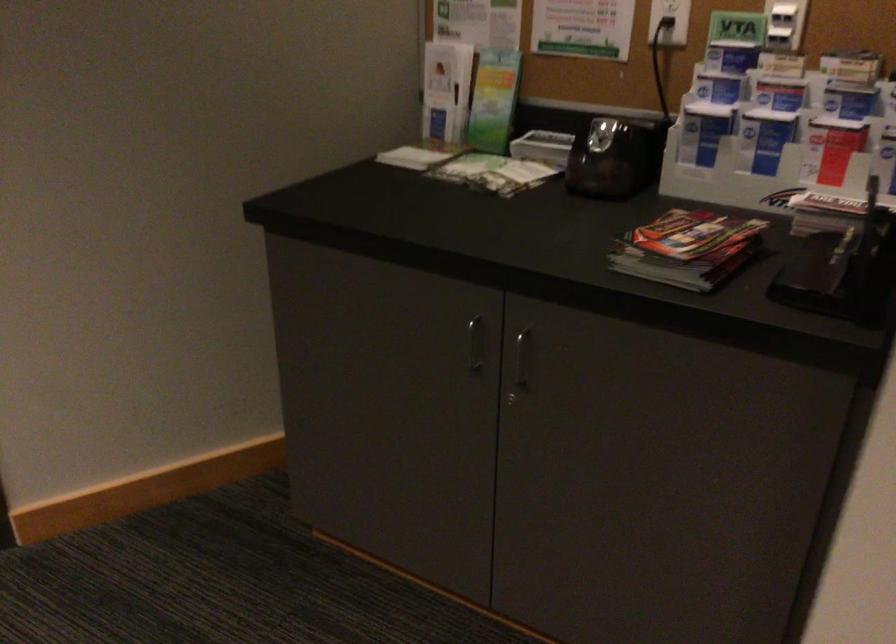
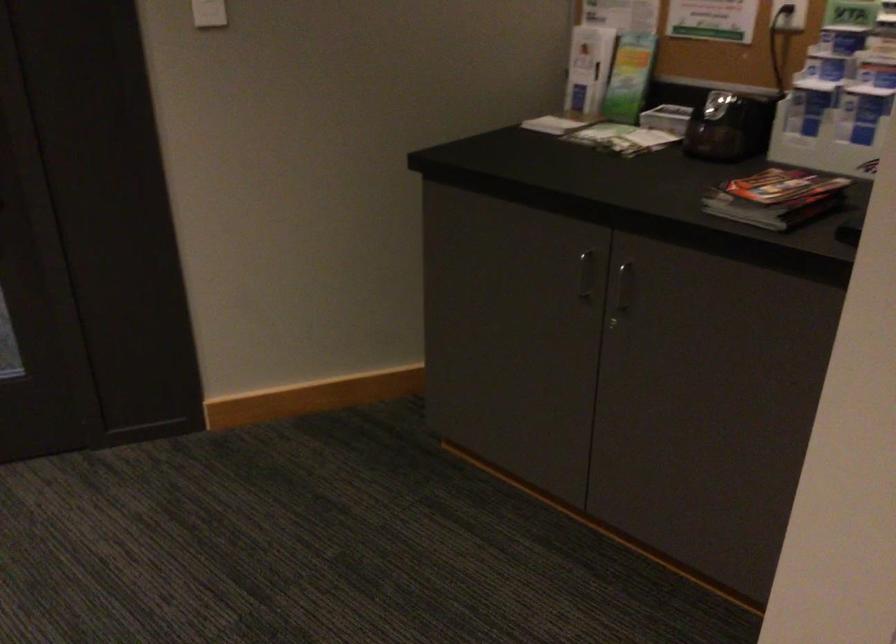
The point at (476, 342) is marked in the first image. Where is the corresponding point in the second image?

(584, 275)